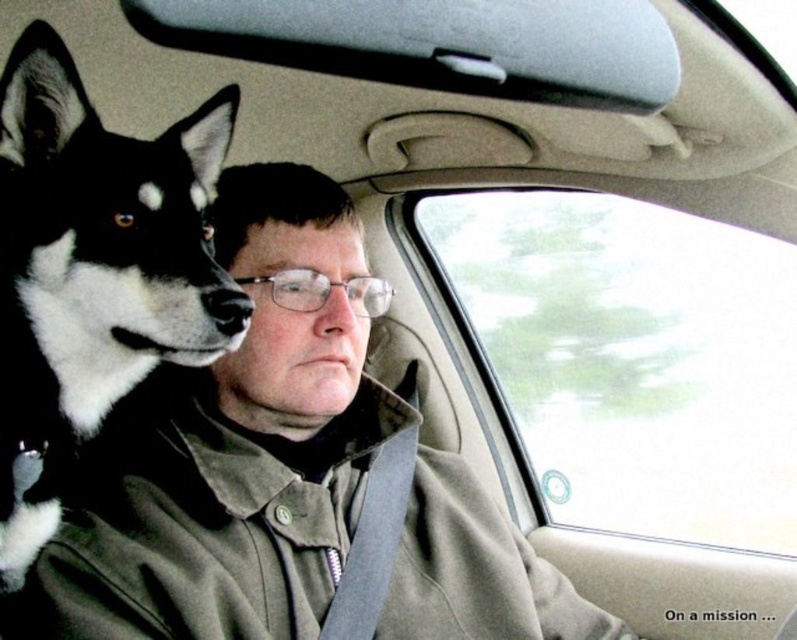
Who is shorter, brown textured fabric trench coat at center or black fur dog at left?

With less height is brown textured fabric trench coat at center.

Which is above, brown textured fabric trench coat at center or black fur dog at left?

black fur dog at left

The width and height of the screenshot is (797, 640). In order to click on brown textured fabric trench coat at center in this screenshot , I will do `click(205, 525)`.

Is point (768, 273) farther from viewer compared to point (210, 196)?

Yes, it is.

Which is in front, point (656, 532) or point (73, 184)?

Point (73, 184) is in front.

Locate an element on the screen. transparent glass window at center is located at coordinates (634, 358).

Is transparent glass window at center taller than brown textured fabric trench coat at center?

Indeed, transparent glass window at center has a greater height compared to brown textured fabric trench coat at center.

Is point (544, 362) closer to viewer compared to point (42, 636)?

No, (544, 362) is behind (42, 636).

Locate an element on the screen. The width and height of the screenshot is (797, 640). transparent glass window at center is located at coordinates (634, 358).